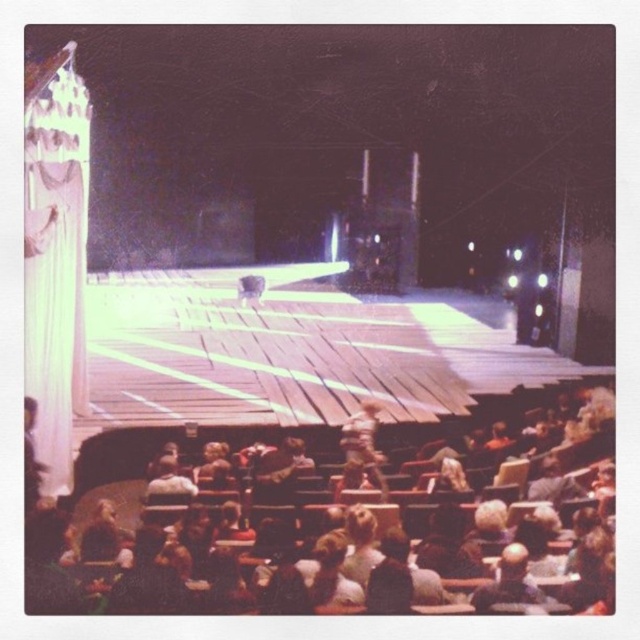
Question: Is wooden chair at lower center thinner than wooden figure at center?

Choices:
 (A) yes
 (B) no

Answer: (A)

Question: Which of the following is the closest to the observer?

Choices:
 (A) (356, 448)
 (B) (506, 433)

Answer: (A)

Question: Which of the following is the closest to the observer?

Choices:
 (A) (358, 452)
 (B) (241, 480)

Answer: (B)

Question: Does wooden chair at lower center appear over wooden figure at center?

Choices:
 (A) yes
 (B) no

Answer: (B)

Question: Does wooden chair at lower center appear over wooden figure at center?

Choices:
 (A) no
 (B) yes

Answer: (A)